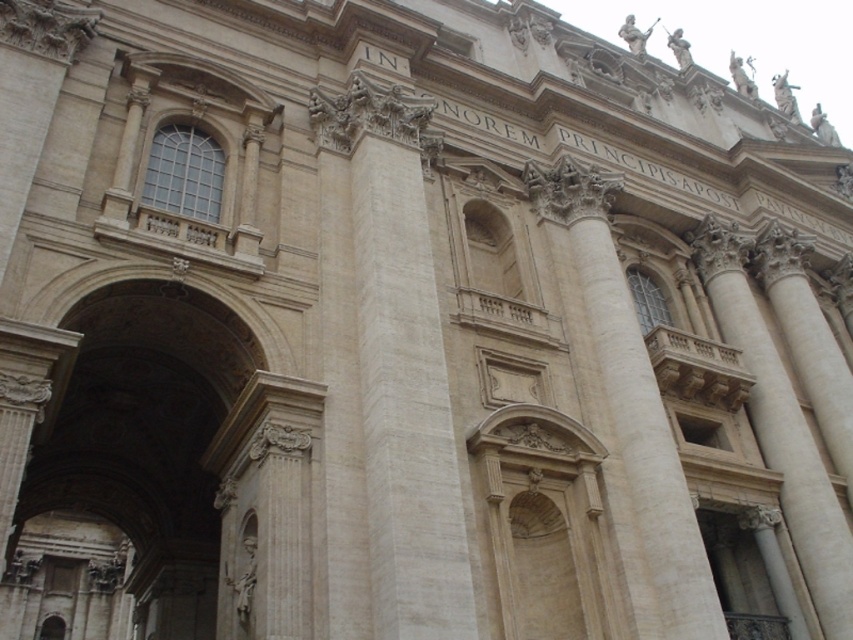
You are an architect examining the facade of a classical building. You notice two columns at the center of the structure. Which column is closer to you, the white marble column at center or the beige stone column at center?

The white marble column at center is closer to you because it is in front of the beige stone column at center.

You are an architect planning to install a decorative banner between the white marble column at center and the smooth stone column at right. The banner is 100 feet long. Will the banner fit between them without needing to be stretched?

The distance between the white marble column at center and the smooth stone column at right is 112.41 feet. Since the banner is only 100 feet long, it will not reach the full distance and will need to be stretched to span the gap.